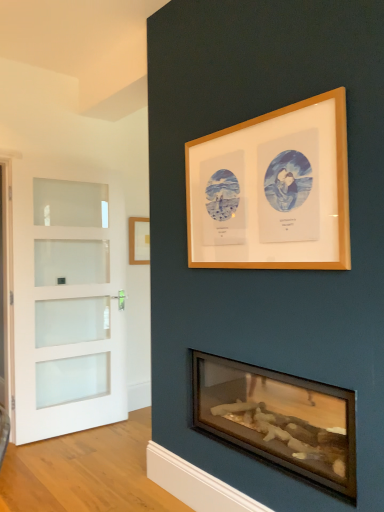
Question: Is white frosted glass door at left taller than wooden logs at lower center?

Choices:
 (A) no
 (B) yes

Answer: (B)

Question: Could you tell me if white frosted glass door at left is facing wooden logs at lower center?

Choices:
 (A) no
 (B) yes

Answer: (B)

Question: Is white frosted glass door at left positioned beyond the bounds of wooden logs at lower center?

Choices:
 (A) yes
 (B) no

Answer: (A)

Question: Can you confirm if white frosted glass door at left is bigger than wooden logs at lower center?

Choices:
 (A) yes
 (B) no

Answer: (B)

Question: Is white frosted glass door at left facing away from wooden logs at lower center?

Choices:
 (A) yes
 (B) no

Answer: (B)

Question: Does white frosted glass door at left have a lesser width compared to wooden logs at lower center?

Choices:
 (A) yes
 (B) no

Answer: (A)

Question: Is white frosted glass door at left to the left of white frosted glass screen door at left from the viewer's perspective?

Choices:
 (A) no
 (B) yes

Answer: (A)

Question: From the image's perspective, is white frosted glass door at left located beneath white frosted glass screen door at left?

Choices:
 (A) yes
 (B) no

Answer: (A)

Question: Does white frosted glass door at left have a larger size compared to white frosted glass screen door at left?

Choices:
 (A) yes
 (B) no

Answer: (A)

Question: From the image's perspective, is white frosted glass door at left located above white frosted glass screen door at left?

Choices:
 (A) yes
 (B) no

Answer: (B)

Question: Is white frosted glass door at left closer to the viewer compared to white frosted glass screen door at left?

Choices:
 (A) yes
 (B) no

Answer: (B)

Question: From a real-world perspective, is white frosted glass door at left physically above white frosted glass screen door at left?

Choices:
 (A) yes
 (B) no

Answer: (B)

Question: From the image's perspective, would you say white frosted glass door at left is shown under wooden picture frame at upper center, marked as the 1th picture frame in a front-to-back arrangement?

Choices:
 (A) yes
 (B) no

Answer: (A)